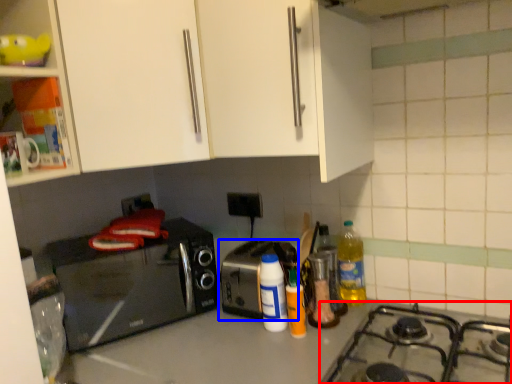
Question: Which of the following is the farthest to the observer, gas stove (highlighted by a red box) or toaster (highlighted by a blue box)?

Choices:
 (A) gas stove
 (B) toaster

Answer: (B)